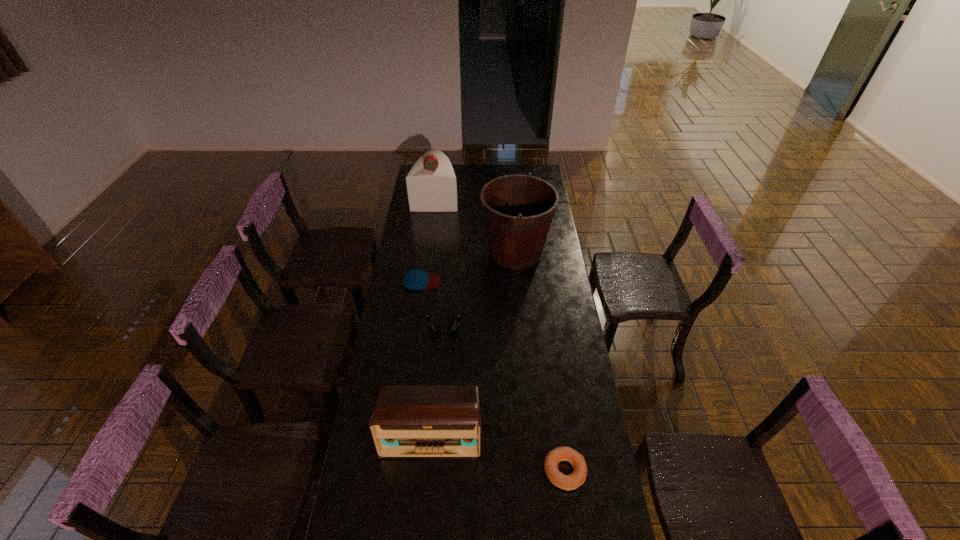
I want to click on bucket, so click(x=518, y=210).

Locate an element on the screen. The height and width of the screenshot is (540, 960). cake is located at coordinates (431, 184).

The image size is (960, 540). Identify the location of radio receiver. pos(408,422).

Locate an element on the screen. This screenshot has width=960, height=540. the third nearest object is located at coordinates (434, 325).

This screenshot has width=960, height=540. Find the location of `the third shortest object`. the third shortest object is located at coordinates (434, 325).

This screenshot has height=540, width=960. I want to click on baseball cap, so click(x=415, y=279).

Locate an element on the screen. The height and width of the screenshot is (540, 960). bagel is located at coordinates pos(567,482).

You are a GUI agent. You are given a task and a screenshot of the screen. Output one action in this format:
    pyautogui.click(x=<x>, y=<y>)
    Task: Click on the blank space located 0.280m on the front of the bucket
    
    Given the screenshot: What is the action you would take?
    pyautogui.click(x=521, y=322)

This screenshot has width=960, height=540. In order to click on vacant space located on the front of the farthest object in this screenshot , I will do `click(430, 241)`.

Locate an element on the screen. This screenshot has width=960, height=540. free location located 0.240m on the front-facing side of the radio receiver is located at coordinates (422, 539).